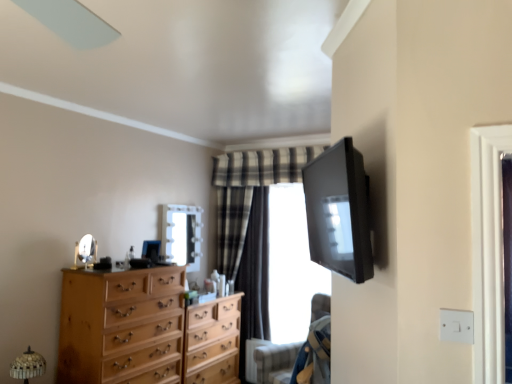
Question: From a real-world perspective, is matte glass mirror at center, the 2th mirror in the left-to-right sequence, over silver/metallic mirror at center-left, which appears as the 1th mirror when viewed from the left?

Choices:
 (A) yes
 (B) no

Answer: (A)

Question: Is matte glass mirror at center, arranged as the first mirror when viewed from the right, at the right side of silver/metallic mirror at center-left, the second mirror when ordered from right to left?

Choices:
 (A) yes
 (B) no

Answer: (A)

Question: From the image's perspective, is matte glass mirror at center, the 2th mirror positioned from the front, above silver/metallic mirror at center-left, the second mirror when ordered from right to left?

Choices:
 (A) yes
 (B) no

Answer: (B)

Question: Is matte glass mirror at center, which is counted as the first mirror, starting from the back, at the left side of silver/metallic mirror at center-left, which is the 2th mirror in back-to-front order?

Choices:
 (A) no
 (B) yes

Answer: (A)

Question: Is matte glass mirror at center, which is counted as the first mirror, starting from the back, further to the viewer compared to silver/metallic mirror at center-left, positioned as the 1th mirror in front-to-back order?

Choices:
 (A) yes
 (B) no

Answer: (A)

Question: Considering the relative sizes of matte glass mirror at center, the 2th mirror positioned from the front, and silver/metallic mirror at center-left, positioned as the 1th mirror in front-to-back order, in the image provided, is matte glass mirror at center, the 2th mirror positioned from the front, taller than silver/metallic mirror at center-left, positioned as the 1th mirror in front-to-back order,?

Choices:
 (A) yes
 (B) no

Answer: (A)

Question: Is silver/metallic mirror at center-left, positioned as the 1th mirror in front-to-back order, far from matte black tv at upper right?

Choices:
 (A) no
 (B) yes

Answer: (B)

Question: Is silver/metallic mirror at center-left, which appears as the 1th mirror when viewed from the left, completely or partially outside of matte black tv at upper right?

Choices:
 (A) no
 (B) yes

Answer: (B)

Question: Is silver/metallic mirror at center-left, which appears as the 1th mirror when viewed from the left, thinner than matte black tv at upper right?

Choices:
 (A) yes
 (B) no

Answer: (A)

Question: Can you confirm if silver/metallic mirror at center-left, which is the 2th mirror in back-to-front order, is positioned to the right of matte black tv at upper right?

Choices:
 (A) yes
 (B) no

Answer: (B)

Question: Does silver/metallic mirror at center-left, the second mirror when ordered from right to left, have a greater width compared to matte black tv at upper right?

Choices:
 (A) yes
 (B) no

Answer: (B)

Question: From the image's perspective, would you say silver/metallic mirror at center-left, which is the 2th mirror in back-to-front order, is shown under matte black tv at upper right?

Choices:
 (A) yes
 (B) no

Answer: (A)

Question: Does plaid fabric curtain at center have a smaller size compared to light wood chest of drawers at center, the second chest of drawers in the front-to-back sequence?

Choices:
 (A) no
 (B) yes

Answer: (B)